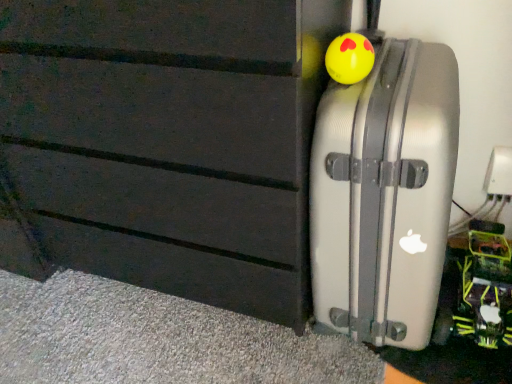
How much space does neon green plastic toy at lower right, the second toy in the front-to-back sequence, occupy vertically?

neon green plastic toy at lower right, the second toy in the front-to-back sequence, is 7.04 inches tall.

At what (x,y) coordinates should I click in order to perform the action: click on yellow rubber ball at upper right, positioned as the second toy in right-to-left order. Please return your answer as a coordinate pair (x, y). This screenshot has height=384, width=512. Looking at the image, I should click on (349, 58).

The image size is (512, 384). I want to click on neon green plastic toy at lower right, which is counted as the 1th toy, starting from the back, so click(485, 287).

Is silver metallic suitcase at right wider or thinner than neon green plastic toy at lower right, which ranks as the second toy in top-to-bottom order?

silver metallic suitcase at right is wider than neon green plastic toy at lower right, which ranks as the second toy in top-to-bottom order.

Is silver metallic suitcase at right in front of or behind neon green plastic toy at lower right, the first toy in the right-to-left sequence, in the image?

In the image, silver metallic suitcase at right appears in front of neon green plastic toy at lower right, the first toy in the right-to-left sequence.

Identify the location of toy lying below the silver metallic suitcase at right (from the image's perspective). (x=485, y=287).

Is yellow rubber ball at upper right, which appears as the 1th toy when viewed from the front, at the back of neon green plastic toy at lower right, arranged as the 1th toy when ordered from the bottom?

No, neon green plastic toy at lower right, arranged as the 1th toy when ordered from the bottom, is not facing away from yellow rubber ball at upper right, which appears as the 1th toy when viewed from the front.

Is neon green plastic toy at lower right, the first toy in the right-to-left sequence, taller or shorter than yellow rubber ball at upper right, positioned as the second toy in right-to-left order?

Considering their sizes, neon green plastic toy at lower right, the first toy in the right-to-left sequence, has more height than yellow rubber ball at upper right, positioned as the second toy in right-to-left order.

Between point (490, 245) and point (353, 40), which one is positioned behind?

Positioned behind is point (490, 245).

Is yellow rubber ball at upper right, which appears as the 1th toy when viewed from the left, far from neon green plastic toy at lower right, the second toy viewed from the left?

No, there isn't a large distance between yellow rubber ball at upper right, which appears as the 1th toy when viewed from the left, and neon green plastic toy at lower right, the second toy viewed from the left.

I want to click on toy lying above the neon green plastic toy at lower right, arranged as the 1th toy when ordered from the bottom (from the image's perspective), so click(x=349, y=58).

Is yellow rubber ball at upper right, acting as the second toy starting from the bottom, aimed at neon green plastic toy at lower right, which is counted as the 1th toy, starting from the back?

No, yellow rubber ball at upper right, acting as the second toy starting from the bottom, is not turned towards neon green plastic toy at lower right, which is counted as the 1th toy, starting from the back.

Is yellow rubber ball at upper right, the 2th toy when ordered from back to front, wider or thinner than neon green plastic toy at lower right, arranged as the 1th toy when ordered from the bottom?

In the image, yellow rubber ball at upper right, the 2th toy when ordered from back to front, appears to be more narrow than neon green plastic toy at lower right, arranged as the 1th toy when ordered from the bottom.

Considering the sizes of objects silver metallic suitcase at right and yellow rubber ball at upper right, the 1th toy positioned from the top, in the image provided, who is taller, silver metallic suitcase at right or yellow rubber ball at upper right, the 1th toy positioned from the top,?

With more height is silver metallic suitcase at right.

How different are the orientations of silver metallic suitcase at right and yellow rubber ball at upper right, which appears as the 1th toy when viewed from the left, in degrees?

0.000709 degrees separate the facing orientations of silver metallic suitcase at right and yellow rubber ball at upper right, which appears as the 1th toy when viewed from the left.

Is silver metallic suitcase at right in contact with yellow rubber ball at upper right, which appears as the 1th toy when viewed from the left?

They are not placed beside each other.

Considering the sizes of objects neon green plastic toy at lower right, arranged as the 1th toy when ordered from the bottom, and silver metallic suitcase at right in the image provided, who is thinner, neon green plastic toy at lower right, arranged as the 1th toy when ordered from the bottom, or silver metallic suitcase at right?

With smaller width is neon green plastic toy at lower right, arranged as the 1th toy when ordered from the bottom.

From a real-world perspective, which is physically above, neon green plastic toy at lower right, the second toy viewed from the left, or silver metallic suitcase at right?

In real-world perspective, silver metallic suitcase at right is above.

Considering the positions of points (337, 76) and (412, 311), is point (337, 76) farther from camera compared to point (412, 311)?

No, it is in front of (412, 311).

Which of these two, yellow rubber ball at upper right, which appears as the 1th toy when viewed from the left, or silver metallic suitcase at right, is smaller?

Smaller between the two is yellow rubber ball at upper right, which appears as the 1th toy when viewed from the left.

Is yellow rubber ball at upper right, which appears as the 1th toy when viewed from the left, closer to camera compared to silver metallic suitcase at right?

No, it is not.

Considering the sizes of yellow rubber ball at upper right, the 2th toy when ordered from back to front, and silver metallic suitcase at right in the image, is yellow rubber ball at upper right, the 2th toy when ordered from back to front, taller or shorter than silver metallic suitcase at right?

In the image, yellow rubber ball at upper right, the 2th toy when ordered from back to front, appears to be shorter than silver metallic suitcase at right.

Identify the location of toy below the silver metallic suitcase at right (from a real-world perspective). This screenshot has height=384, width=512. (485, 287).

Where is `toy above the neon green plastic toy at lower right, which ranks as the second toy in top-to-bottom order (from the image's perspective)`? toy above the neon green plastic toy at lower right, which ranks as the second toy in top-to-bottom order (from the image's perspective) is located at coordinates (349, 58).

Considering their positions, is silver metallic suitcase at right positioned closer to yellow rubber ball at upper right, which appears as the 1th toy when viewed from the front, than neon green plastic toy at lower right, the second toy viewed from the left?

silver metallic suitcase at right is closer to yellow rubber ball at upper right, which appears as the 1th toy when viewed from the front.

Estimate the real-world distances between objects in this image. Which object is closer to silver metallic suitcase at right, neon green plastic toy at lower right, arranged as the 1th toy when ordered from the bottom, or yellow rubber ball at upper right, which appears as the 1th toy when viewed from the left?

yellow rubber ball at upper right, which appears as the 1th toy when viewed from the left, is closer to silver metallic suitcase at right.

Which object lies further to the anchor point silver metallic suitcase at right, yellow rubber ball at upper right, which appears as the 1th toy when viewed from the front, or neon green plastic toy at lower right, which is counted as the 1th toy, starting from the back?

neon green plastic toy at lower right, which is counted as the 1th toy, starting from the back.

Looking at the image, which one is located closer to neon green plastic toy at lower right, which is counted as the 1th toy, starting from the back, yellow rubber ball at upper right, which appears as the 1th toy when viewed from the left, or silver metallic suitcase at right?

Result: silver metallic suitcase at right is positioned closer to the anchor neon green plastic toy at lower right, which is counted as the 1th toy, starting from the back.

From the image, which object appears to be nearer to yellow rubber ball at upper right, acting as the second toy starting from the bottom, neon green plastic toy at lower right, arranged as the 1th toy when ordered from the bottom, or silver metallic suitcase at right?

silver metallic suitcase at right.

Estimate the real-world distances between objects in this image. Which object is further from neon green plastic toy at lower right, the second toy in the front-to-back sequence, silver metallic suitcase at right or yellow rubber ball at upper right, the 2th toy when ordered from back to front?

yellow rubber ball at upper right, the 2th toy when ordered from back to front, is further to neon green plastic toy at lower right, the second toy in the front-to-back sequence.

Identify the location of suitcase that lies between yellow rubber ball at upper right, the 1th toy positioned from the top, and neon green plastic toy at lower right, the first toy in the right-to-left sequence, from top to bottom. This screenshot has height=384, width=512. (384, 194).